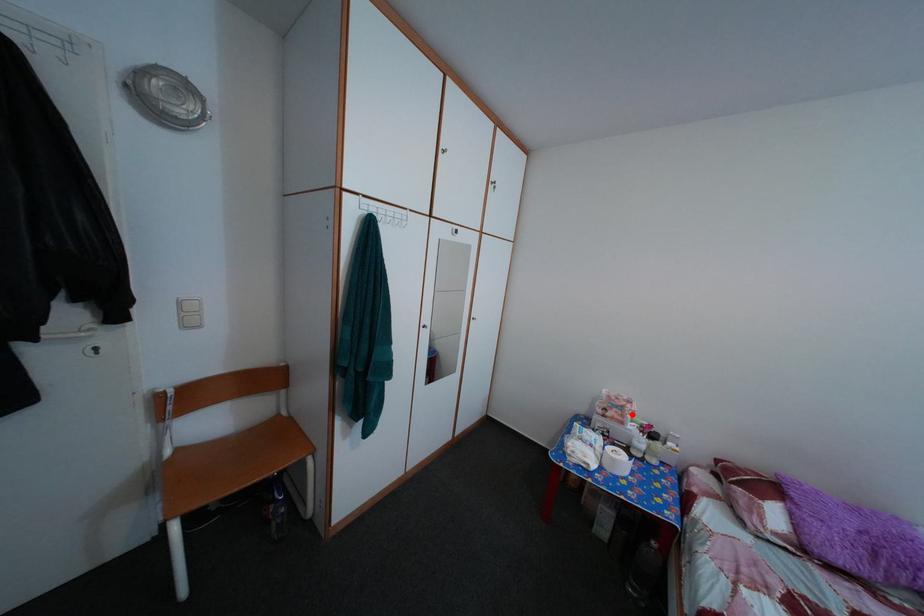
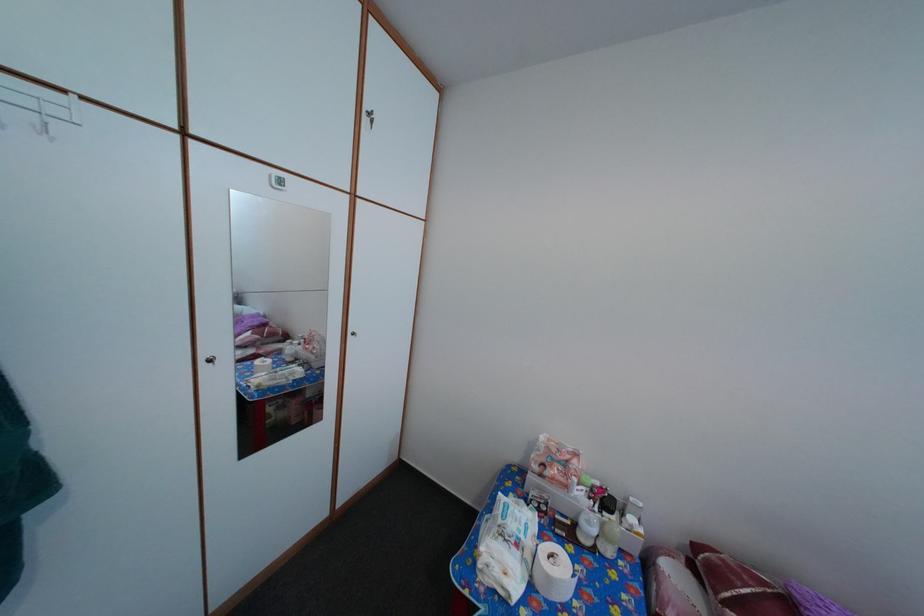
Question: I am providing you with two images of the same scene from different viewpoints. A red point is marked on the first image. At the location where the point appears in image 1, is it still visible in image 2?

Choices:
 (A) Yes
 (B) No

Answer: (A)